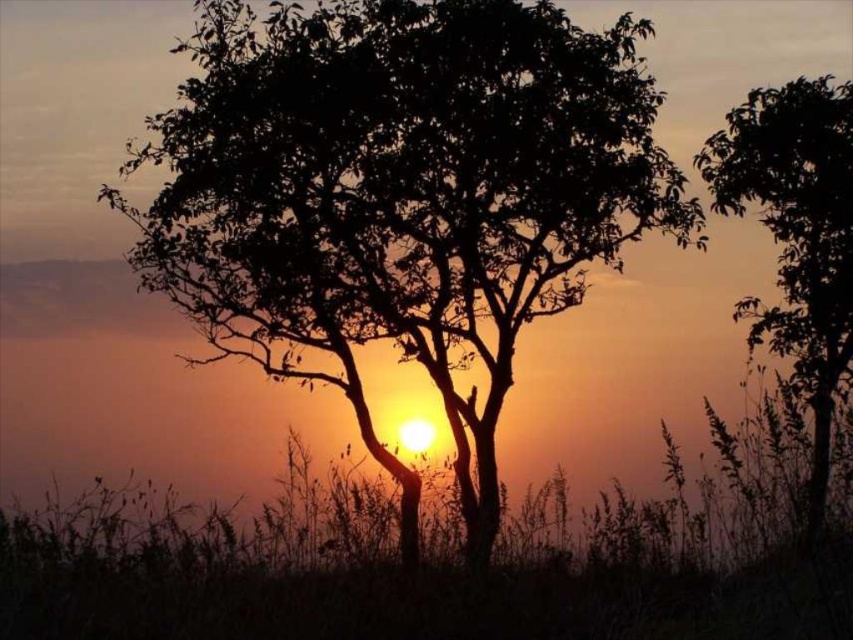
You are an artist sketching the sunset scene. You notice two silhouette leafy trees in the image. Which tree, the silhouette leafy tree at center or the silhouette leafy tree at right, is located more to the left side of the other?

The silhouette leafy tree at center is positioned on the left side of the silhouette leafy tree at right, so the silhouette leafy tree at center is more to the left.

Consider the image. You are standing at the center of the image and want to walk towards the silhouette leafy tree at center. In which direction should you move?

The silhouette leafy tree at center is already at the center of the image, so you are already facing it directly. No need to move in any direction.

You are standing in the middle of a park and see two silhouette leafy trees. One is the silhouette leafy tree at center and the other is the silhouette leafy tree at right. If you want to walk to the closer tree, which one should you head towards?

The silhouette leafy tree at center is 2.66 meters away from the silhouette leafy tree at right. Since you are standing in the middle of the park, the closer tree would depend on your exact position. However, based on the given distance between them, if you are equidistant from both, you can choose either. But the question states to determine which is closer, so perhaps there is an error in the setup?